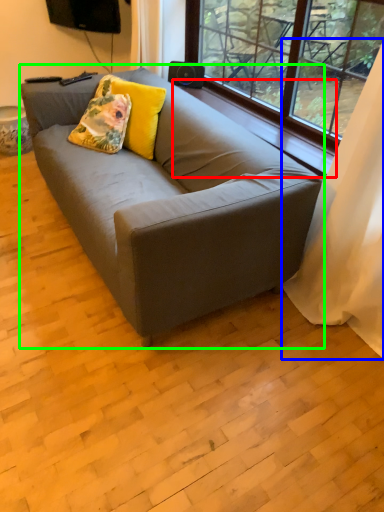
Question: Considering the real-world distances, which object is closest to window sill (highlighted by a red box)? curtain (highlighted by a blue box) or studio couch (highlighted by a green box).

Choices:
 (A) curtain
 (B) studio couch

Answer: (A)